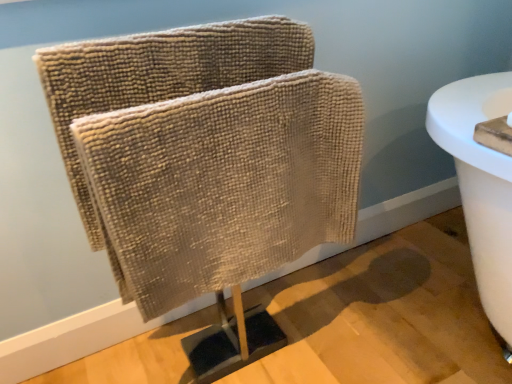
Describe the element at coordinates (205, 153) in the screenshot. I see `beige textured towel at center` at that location.

Find the location of a particular element. This screenshot has width=512, height=384. beige textured towel at center is located at coordinates (205, 153).

Identify the location of beige textured towel at center. (205, 153).